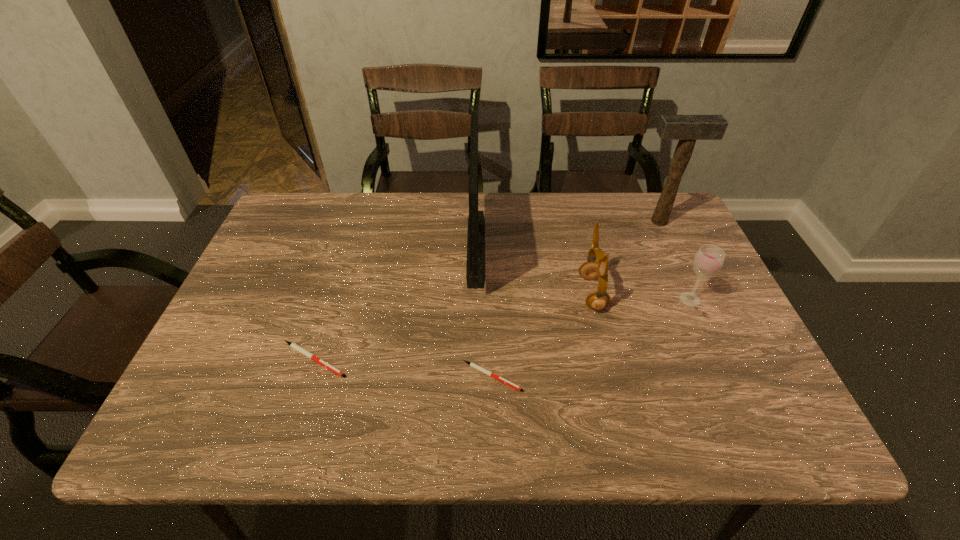
At what (x,y) coordinates should I click in order to perform the action: click on wineglass that is at the right edge. Please return your answer as a coordinate pair (x, y). The width and height of the screenshot is (960, 540). Looking at the image, I should click on (709, 259).

Find the location of `object present at the far right corner`. object present at the far right corner is located at coordinates (687, 129).

In the image, there is a desktop. What are the coordinates of `vacant space at the far edge` in the screenshot? It's located at (468, 195).

Where is `vacant space at the near edge`? The image size is (960, 540). vacant space at the near edge is located at coordinates (293, 396).

Image resolution: width=960 pixels, height=540 pixels. Identify the location of free location at the right edge of the desktop. (726, 300).

Locate an element on the screen. free space at the far left corner of the desktop is located at coordinates (300, 198).

The image size is (960, 540). In the image, there is a desktop. What are the coordinates of `blank space at the near left corner` in the screenshot? It's located at [249, 379].

Locate an element on the screen. vacant area that lies between the fourth tallest object and the shortest object is located at coordinates (591, 338).

At what (x,y) coordinates should I click in order to perform the action: click on vacant point located between the shortest object and the left pen. Please return your answer as a coordinate pair (x, y). The image size is (960, 540). Looking at the image, I should click on (403, 368).

Find the location of a particular element. This screenshot has height=540, width=960. free point between the third shortest object and the shorter pen is located at coordinates (591, 338).